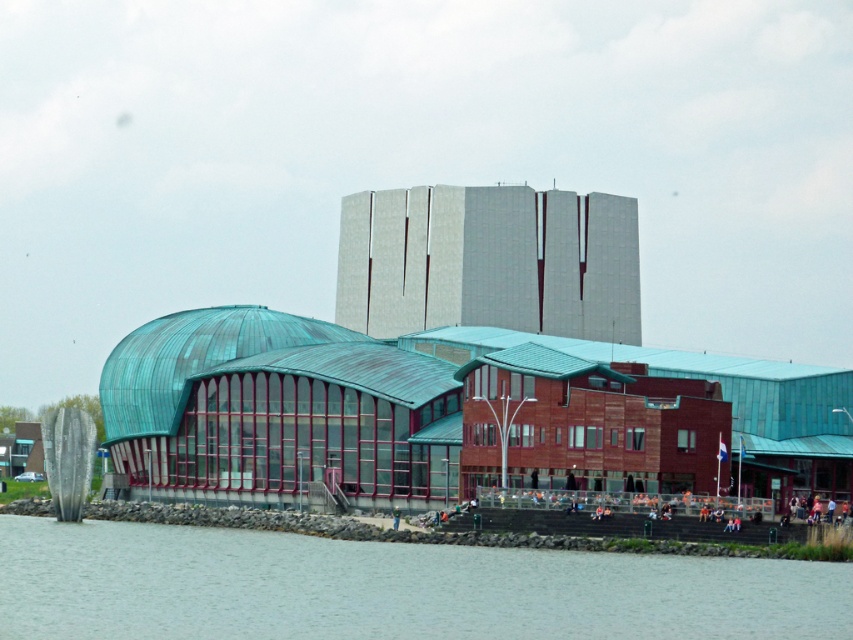
Looking at this image, you are standing at the point marked as point [389,588] in the image. What is located at this point?

The point [389,588] is where the gray concrete river at lower left is located.

You are an architect evaluating the spatial relationship between the gray concrete river at lower left and the smooth concrete tower at upper center. Based on the scene, which object occupies more space in the image?

The gray concrete river at lower left has a larger size compared to the smooth concrete tower at upper center, so it occupies more space in the image.

You are a visitor standing at the entrance of the complex and want to take a photo of the gray concrete river at lower left and the smooth concrete tower at upper center. Which object will appear taller in the photo?

The smooth concrete tower at upper center will appear taller in the photo because it has a greater height than the gray concrete river at lower left.